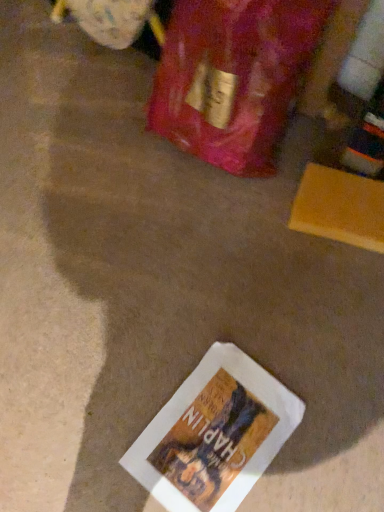
Question: Is white paper book at lower center at the right side of clear glass wine bottle at upper right?

Choices:
 (A) yes
 (B) no

Answer: (B)

Question: Is white paper book at lower center bigger than clear glass wine bottle at upper right?

Choices:
 (A) no
 (B) yes

Answer: (A)

Question: Is white paper book at lower center taller than clear glass wine bottle at upper right?

Choices:
 (A) yes
 (B) no

Answer: (B)

Question: Are white paper book at lower center and clear glass wine bottle at upper right located far from each other?

Choices:
 (A) yes
 (B) no

Answer: (B)

Question: From a real-world perspective, is white paper book at lower center located beneath clear glass wine bottle at upper right?

Choices:
 (A) no
 (B) yes

Answer: (B)

Question: Can we say white paper book at lower center lies outside clear glass wine bottle at upper right?

Choices:
 (A) no
 (B) yes

Answer: (B)

Question: From the image's perspective, is clear glass wine bottle at upper right located above white paper book at lower center?

Choices:
 (A) yes
 (B) no

Answer: (A)

Question: Can you confirm if clear glass wine bottle at upper right is bigger than white paper book at lower center?

Choices:
 (A) yes
 (B) no

Answer: (A)

Question: Is clear glass wine bottle at upper right to the left of white paper book at lower center from the viewer's perspective?

Choices:
 (A) yes
 (B) no

Answer: (B)

Question: Is clear glass wine bottle at upper right taller than white paper book at lower center?

Choices:
 (A) yes
 (B) no

Answer: (A)

Question: Is clear glass wine bottle at upper right positioned with its back to white paper book at lower center?

Choices:
 (A) no
 (B) yes

Answer: (A)

Question: Is clear glass wine bottle at upper right next to white paper book at lower center?

Choices:
 (A) yes
 (B) no

Answer: (B)

Question: Based on their positions, is clear glass wine bottle at upper right located to the left or right of white paper book at lower center?

Choices:
 (A) left
 (B) right

Answer: (B)